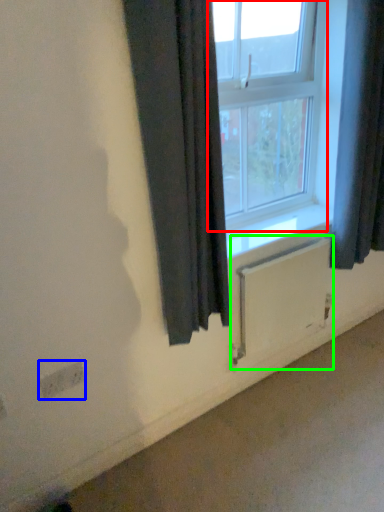
Question: Considering the real-world distances, which object is closest to window (highlighted by a red box)? electric outlet (highlighted by a blue box) or radiator (highlighted by a green box).

Choices:
 (A) electric outlet
 (B) radiator

Answer: (B)